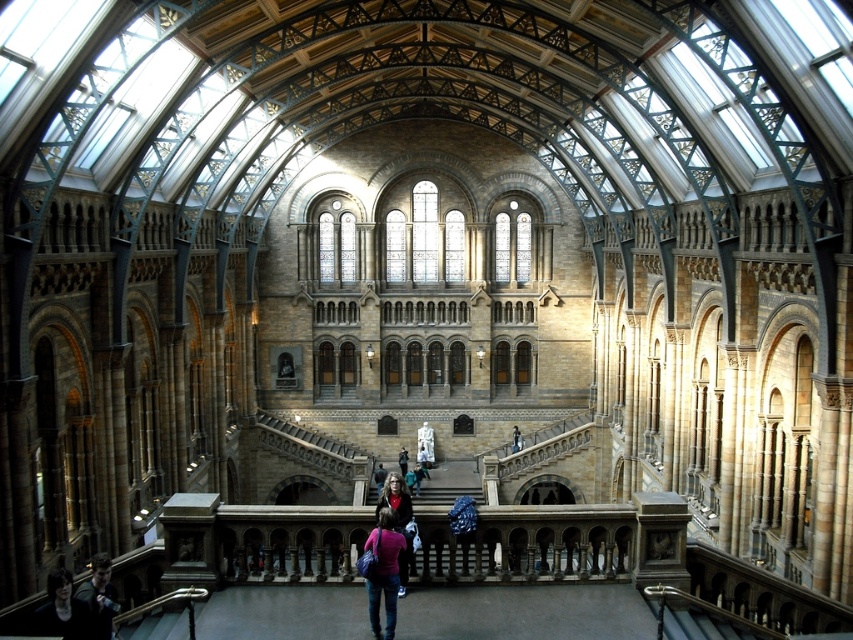
Which is behind, point (86, 596) or point (399, 584)?

Positioned behind is point (399, 584).

Does dark blue jeans at lower left have a greater height compared to dark brown leather jacket at center?

No.

Locate an element on the screen. dark blue jeans at lower left is located at coordinates (99, 598).

Identify the location of dark blue jeans at lower left. The height and width of the screenshot is (640, 853). (99, 598).

Is matte purple sweater at center to the left of dark brown leather jacket at center from the viewer's perspective?

No, matte purple sweater at center is not to the left of dark brown leather jacket at center.

Is the position of matte purple sweater at center less distant than that of dark brown leather jacket at center?

Yes.

Identify the location of matte purple sweater at center. This screenshot has width=853, height=640. (383, 572).

Where is `matte purple sweater at center`? The width and height of the screenshot is (853, 640). matte purple sweater at center is located at coordinates (383, 572).

Is point (97, 605) positioned after point (419, 467)?

No, (97, 605) is closer to viewer.

Does dark blue jeans at lower left have a lesser height compared to matte white statue at center?

Incorrect, dark blue jeans at lower left's height does not fall short of matte white statue at center's.

Is point (105, 586) positioned behind point (428, 477)?

No.

Identify the location of dark blue jeans at lower left. The height and width of the screenshot is (640, 853). (99, 598).